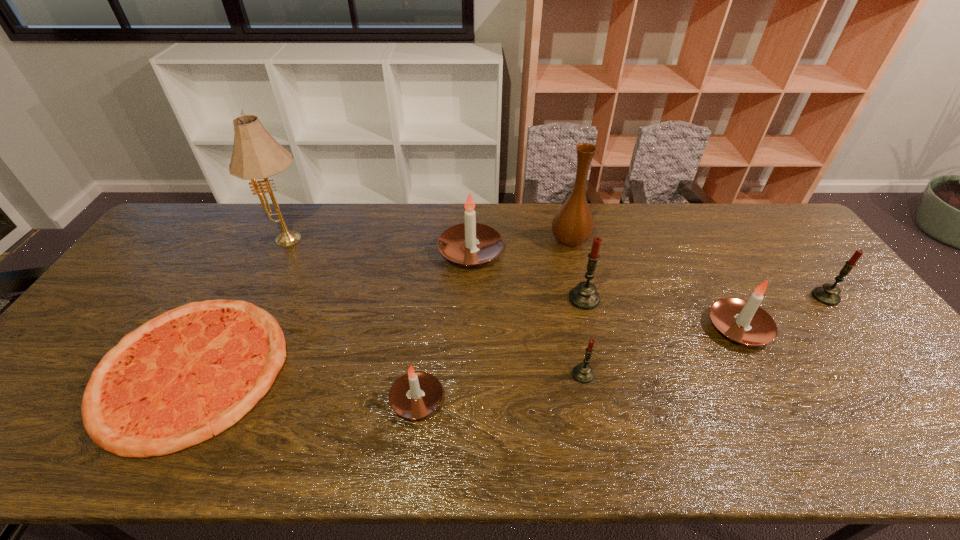
Image resolution: width=960 pixels, height=540 pixels. I want to click on object that is at the right edge, so click(828, 294).

Where is `object present at the near left corner`? Image resolution: width=960 pixels, height=540 pixels. object present at the near left corner is located at coordinates (185, 376).

Image resolution: width=960 pixels, height=540 pixels. Find the location of `free space at the far edge`. free space at the far edge is located at coordinates click(240, 219).

Find the location of `vacant space at the near edge of the desktop`. vacant space at the near edge of the desktop is located at coordinates (868, 437).

The height and width of the screenshot is (540, 960). In the image, there is a desktop. Find the location of `free space at the left edge`. free space at the left edge is located at coordinates (79, 345).

The image size is (960, 540). What are the coordinates of `free space at the right edge of the desktop` in the screenshot? It's located at (891, 412).

The width and height of the screenshot is (960, 540). I want to click on vacant space at the far left corner of the desktop, so click(x=196, y=228).

This screenshot has height=540, width=960. Find the location of `vacant region between the biggest white candle and the nearest red candle`. vacant region between the biggest white candle and the nearest red candle is located at coordinates (527, 313).

The image size is (960, 540). I want to click on free space between the nearest red candle and the pizza, so (388, 372).

Image resolution: width=960 pixels, height=540 pixels. What are the coordinates of `free point between the farthest candle and the biggest red candle` in the screenshot? It's located at (527, 275).